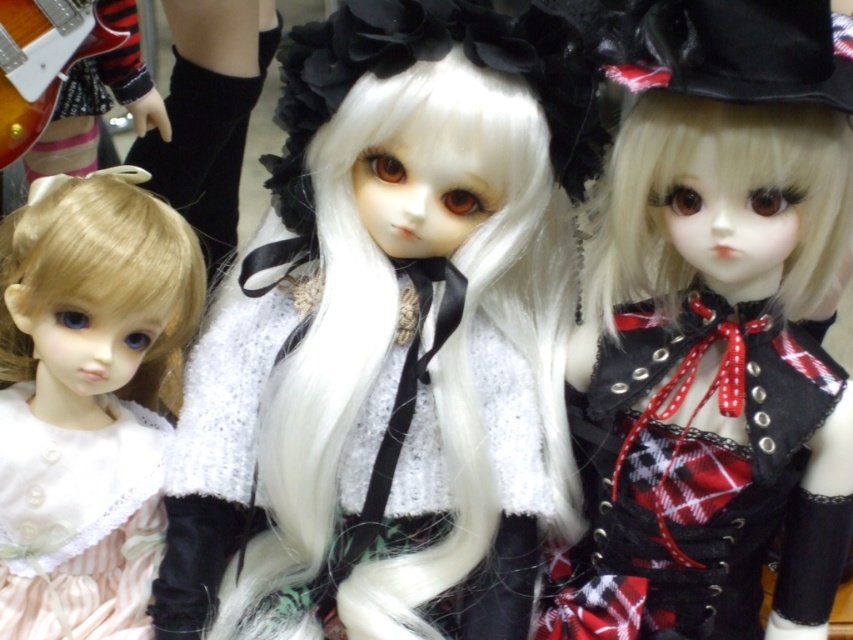
Can you confirm if white lace dress at center is positioned below pastel striped fabric dress at left?

Incorrect, white lace dress at center is not positioned below pastel striped fabric dress at left.

Is point (492, 13) closer to camera compared to point (167, 269)?

Yes.

Find the location of a particular element. This screenshot has height=640, width=853. white lace dress at center is located at coordinates (390, 339).

Can you confirm if white lace dress at center is positioned below matte black dress at center?

Correct, white lace dress at center is located below matte black dress at center.

This screenshot has height=640, width=853. What do you see at coordinates (390, 339) in the screenshot?
I see `white lace dress at center` at bounding box center [390, 339].

Where is `white lace dress at center`? This screenshot has height=640, width=853. white lace dress at center is located at coordinates (390, 339).

Based on the photo, between pastel striped fabric dress at left and pale pink lace dress at left, which one is positioned higher?

pastel striped fabric dress at left is higher up.

Does pastel striped fabric dress at left appear on the left side of pale pink lace dress at left?

Incorrect, pastel striped fabric dress at left is not on the left side of pale pink lace dress at left.

Which is behind, point (144, 396) or point (50, 592)?

The point (144, 396) is more distant.

Locate an element on the screen. The image size is (853, 640). pastel striped fabric dress at left is located at coordinates (86, 401).